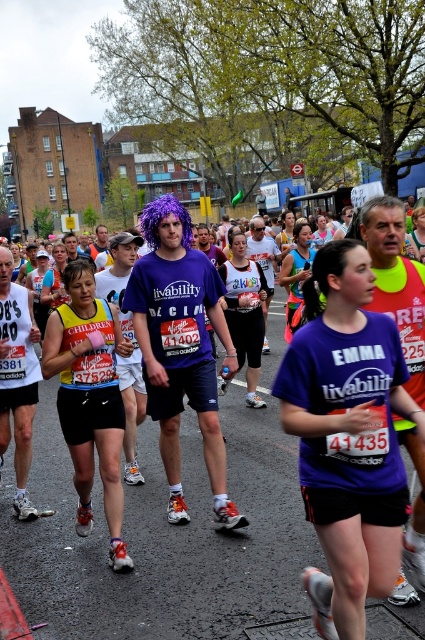
Who is lower down, purple synthetic wig at center or yellow reflective vest at center?

yellow reflective vest at center is lower down.

Where is `purple synthetic wig at center`? The height and width of the screenshot is (640, 425). purple synthetic wig at center is located at coordinates (181, 348).

Who is shorter, purple fabric shirt at center or yellow reflective vest at center?

purple fabric shirt at center

Is purple fabric shirt at center below yellow reflective vest at center?

Actually, purple fabric shirt at center is above yellow reflective vest at center.

Between point (337, 308) and point (79, 444), which one is positioned in front?

Point (337, 308) is more forward.

Where is `purple fabric shirt at center`? purple fabric shirt at center is located at coordinates (348, 436).

Who is more forward, [323,592] or [158,275]?

Point [323,592]

Between purple fabric shirt at center and purple synthetic wig at center, which one is positioned lower?

purple fabric shirt at center is lower down.

Measure the distance between purple fabric shirt at center and camera.

purple fabric shirt at center is 9.40 feet away from camera.

At what (x,y) coordinates should I click in order to perform the action: click on purple fabric shirt at center. Please return your answer as a coordinate pair (x, y). Looking at the image, I should click on (348, 436).